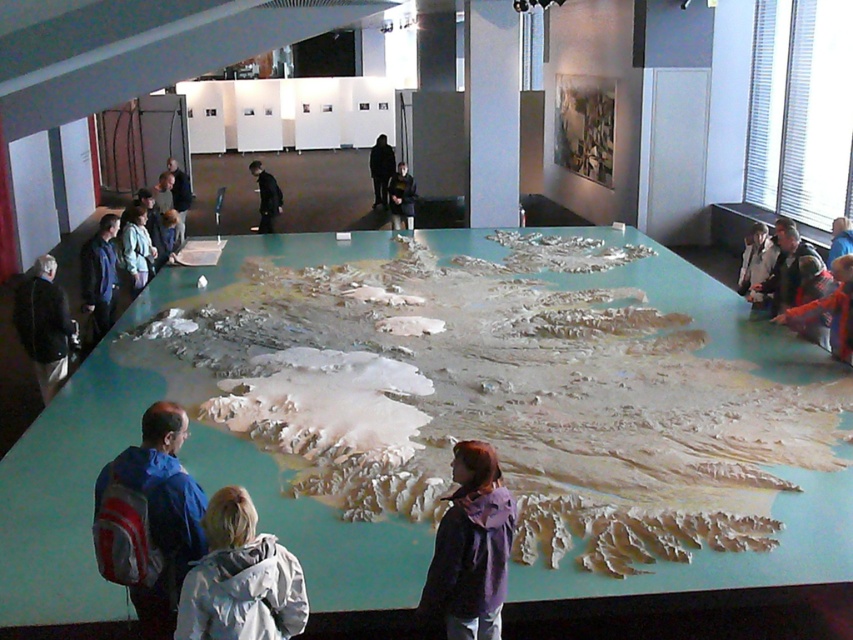
Between point (398, 182) and point (270, 202), which one is positioned in front?

Point (270, 202) is more forward.

Who is higher up, dark gray sweater at center or black matte jacket at center?

Positioned higher is dark gray sweater at center.

Does point (392, 224) come farther from viewer compared to point (270, 205)?

That is True.

Identify the location of dark gray sweater at center. The image size is (853, 640). (401, 196).

In the scene shown: Can you confirm if dark blue jacket at left is thinner than dark blue jacket at center?

Yes, dark blue jacket at left is thinner than dark blue jacket at center.

Can you confirm if dark blue jacket at left is smaller than dark blue jacket at center?

Yes, dark blue jacket at left is smaller than dark blue jacket at center.

Between point (53, 298) and point (393, 163), which one is positioned in front?

Positioned in front is point (53, 298).

Where is `dark blue jacket at left`? dark blue jacket at left is located at coordinates (44, 324).

Who is lower down, white matte jacket at lower center or black matte jacket at center?

Positioned lower is white matte jacket at lower center.

Is white matte jacket at lower center further to the viewer compared to black matte jacket at center?

No, white matte jacket at lower center is closer to the viewer.

I want to click on white matte jacket at lower center, so click(x=241, y=579).